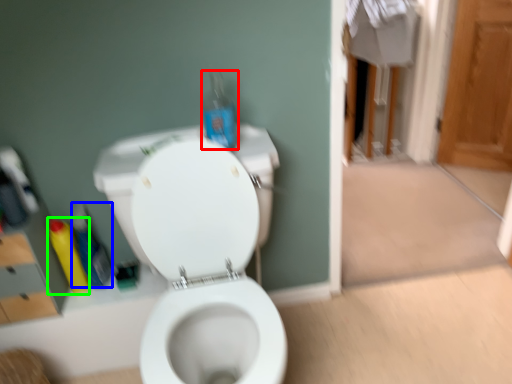
Question: Considering the real-world distances, which object is closest to bottle (highlighted by a red box)? cleaning product (highlighted by a blue box) or cleaning product (highlighted by a green box).

Choices:
 (A) cleaning product
 (B) cleaning product

Answer: (A)